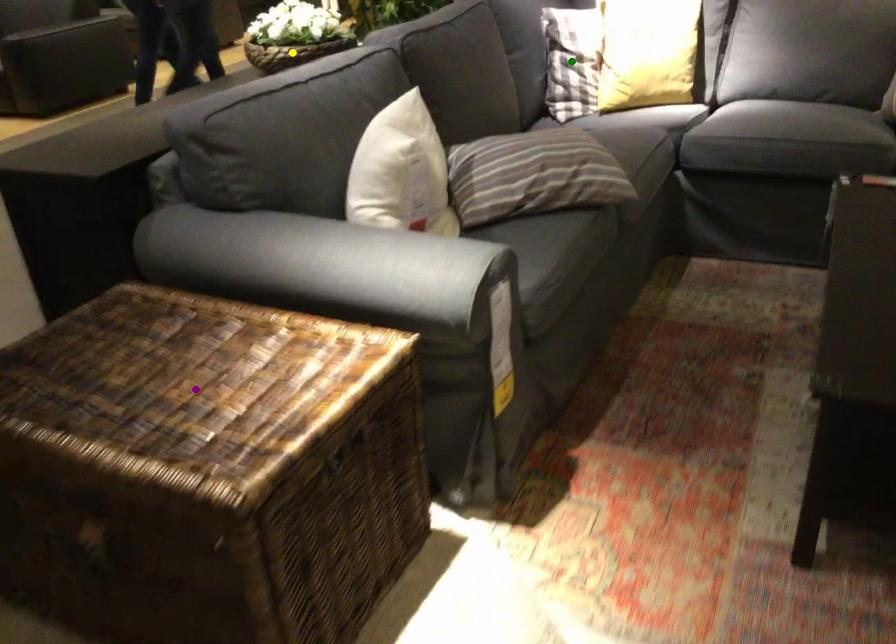
Order these from nearest to farthest:
green point
purple point
yellow point

purple point → yellow point → green point